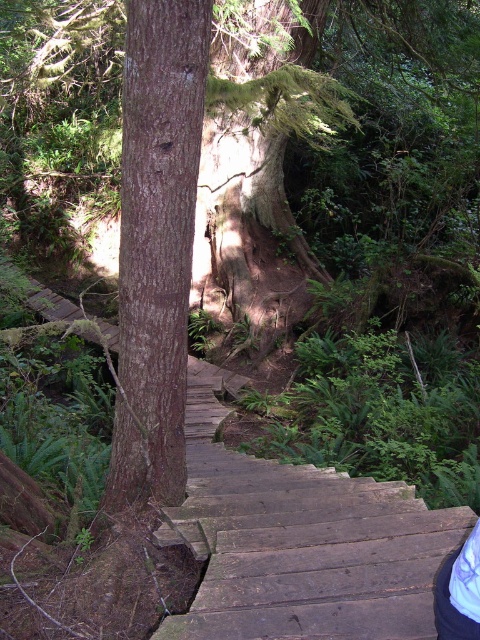
Who is taller, wooden stairs at center or brown rough bark tree at center?

brown rough bark tree at center

Is point (240, 464) closer to viewer compared to point (146, 296)?

No, (240, 464) is further to viewer.

In order to click on wooden stairs at center in this screenshot , I will do `click(299, 541)`.

Image resolution: width=480 pixels, height=640 pixels. I want to click on wooden stairs at center, so click(x=299, y=541).